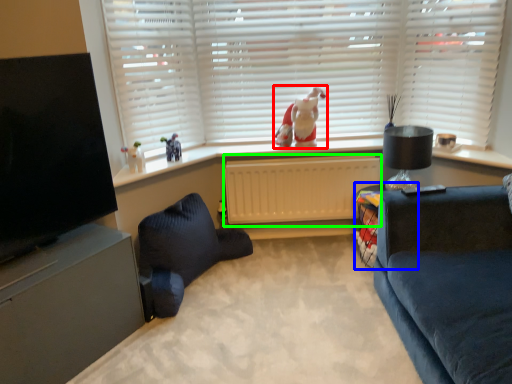
Question: Estimate the real-world distances between objects in this image. Which object is closer to toy (highlighted by a red box), table (highlighted by a blue box) or radiator (highlighted by a green box)?

Choices:
 (A) table
 (B) radiator

Answer: (B)